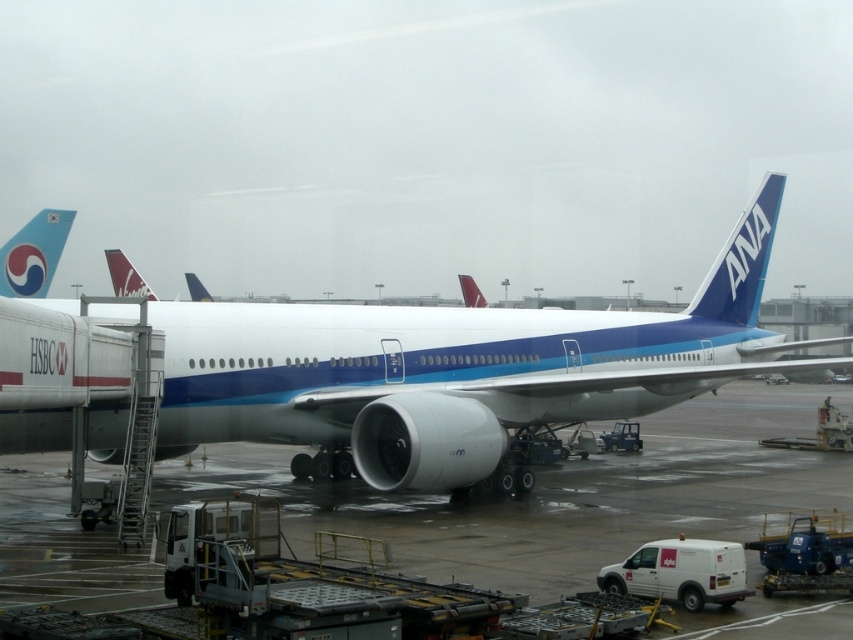
Is white glossy airplane at center smaller than blue glossy tail fin at upper right?

Incorrect, white glossy airplane at center is not smaller in size than blue glossy tail fin at upper right.

Where is `white glossy airplane at center`? This screenshot has height=640, width=853. white glossy airplane at center is located at coordinates (457, 369).

Is point (169, 419) positioned in front of point (788, 468)?

Yes, point (169, 419) is closer to viewer.

Does white glossy airplane at center appear under smooth concrete tarmac at center?

Actually, white glossy airplane at center is above smooth concrete tarmac at center.

What do you see at coordinates (457, 369) in the screenshot? I see `white glossy airplane at center` at bounding box center [457, 369].

Image resolution: width=853 pixels, height=640 pixels. In order to click on white glossy airplane at center in this screenshot , I will do `click(457, 369)`.

In order to click on smooth concrete tarmac at center in this screenshot , I will do `click(566, 493)`.

Can you confirm if smooth concrete tarmac at center is thinner than blue glossy tail at upper left?

Yes, smooth concrete tarmac at center is thinner than blue glossy tail at upper left.

Locate an element on the screen. The image size is (853, 640). smooth concrete tarmac at center is located at coordinates (566, 493).

What are the coordinates of `smooth concrete tarmac at center` in the screenshot? It's located at (566, 493).